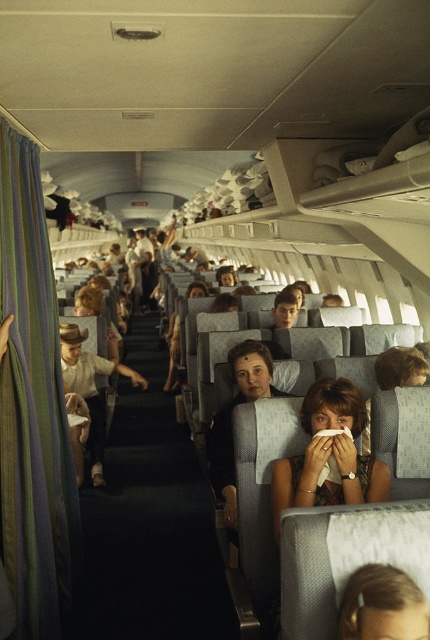
Does point (193, 560) come farther from viewer compared to point (214, 486)?

Yes, point (193, 560) is behind point (214, 486).

Which of these two, black fabric at center or matte black hair at center, stands shorter?

With less height is black fabric at center.

What do you see at coordinates (150, 522) in the screenshot? Image resolution: width=430 pixels, height=640 pixels. I see `black fabric at center` at bounding box center [150, 522].

The width and height of the screenshot is (430, 640). What are the coordinates of `black fabric at center` in the screenshot? It's located at (150, 522).

From the picture: Does black fabric at center have a lesser width compared to matte gray hair at center?

No.

Is point (181, 481) less distant than point (289, 497)?

No, (181, 481) is further to viewer.

This screenshot has width=430, height=640. In order to click on black fabric at center in this screenshot , I will do `click(150, 522)`.

Does matte gray hair at center have a lesser width compared to matte black hair at center?

Yes.

Does point (276, 468) come closer to viewer compared to point (240, 380)?

Yes, it is.

Find the location of `matte gray hair at center`. matte gray hair at center is located at coordinates (328, 454).